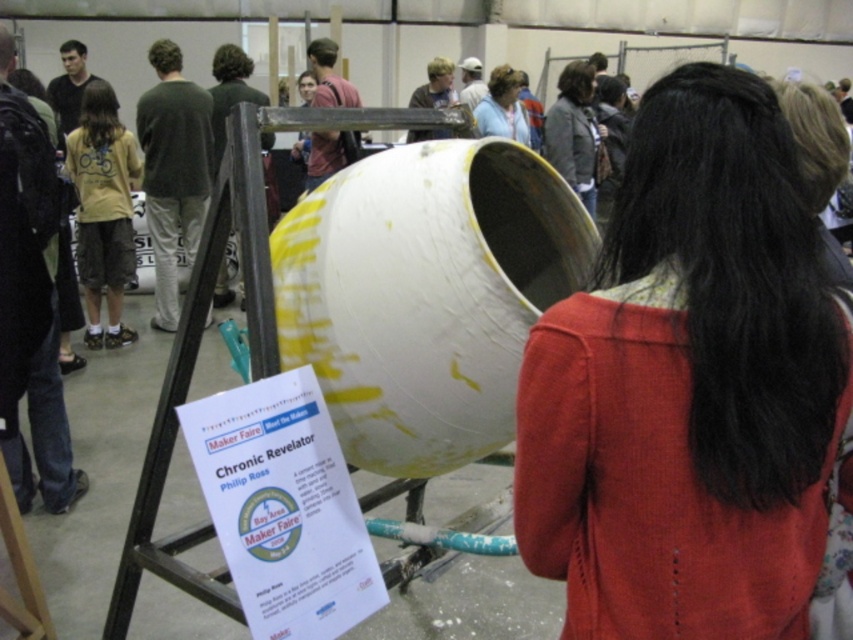
You are a photographer at the Maker Faire event. You need to capture a photo of the dark brown leather jacket at center and the light blue fabric shirt at upper center. Which object is wider in the scene?

The dark brown leather jacket at center is wider than the light blue fabric shirt at upper center.

Based on the photo, you are at the Maker Faire and see two people in front of the exhibit. One is wearing a knitted red sweater at center and the other has a light blue fabric shirt at upper center. Which person is standing closer to you?

The knitted red sweater at center is closer to the viewer than the light blue fabric shirt at upper center, so the person in the knitted red sweater at center is standing closer to you.

What is the spatial relationship between the knitted red sweater at center and the light blue fabric shirt at upper center?

The knitted red sweater at center is located below the light blue fabric shirt at upper center.